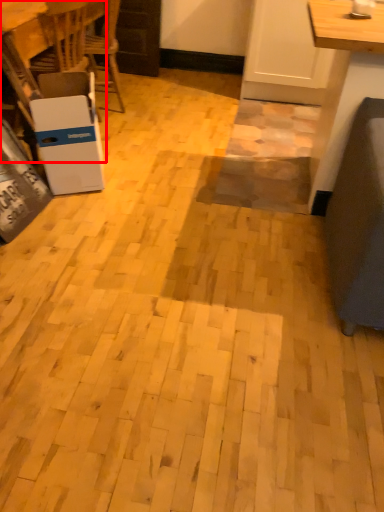
Question: Observing the image, what is the correct spatial positioning of table (annotated by the red box) in reference to cardboard box?

Choices:
 (A) right
 (B) left

Answer: (B)